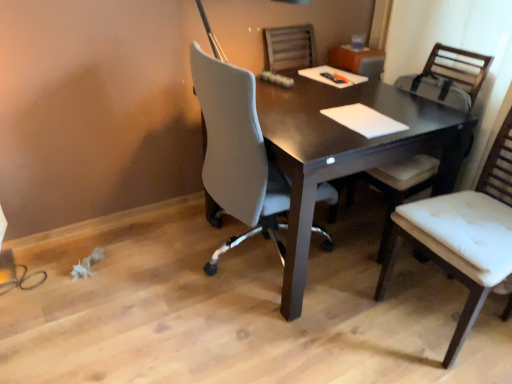
Question: From a real-world perspective, is white leather chair at right, which is the 1th chair in front-to-back order, positioned above or below white fabric chair at right, positioned as the 2th chair in front-to-back order?

Choices:
 (A) below
 (B) above

Answer: (B)

Question: Considering the positions of white leather chair at right, arranged as the second chair when viewed from the back, and white fabric chair at right, positioned as the 2th chair in front-to-back order, in the image, is white leather chair at right, arranged as the second chair when viewed from the back, wider or thinner than white fabric chair at right, positioned as the 2th chair in front-to-back order,?

Choices:
 (A) thin
 (B) wide

Answer: (A)

Question: Considering the real-world distances, which object is farthest from the dark wood desk at center?

Choices:
 (A) white leather chair at right, arranged as the second chair when viewed from the back
 (B) white fabric chair at right, positioned as the 2th chair in front-to-back order

Answer: (A)

Question: Estimate the real-world distances between objects in this image. Which object is closer to the white fabric chair at right, positioned as the 2th chair in front-to-back order?

Choices:
 (A) dark wood desk at center
 (B) white leather chair at right, which is the 1th chair in front-to-back order

Answer: (A)